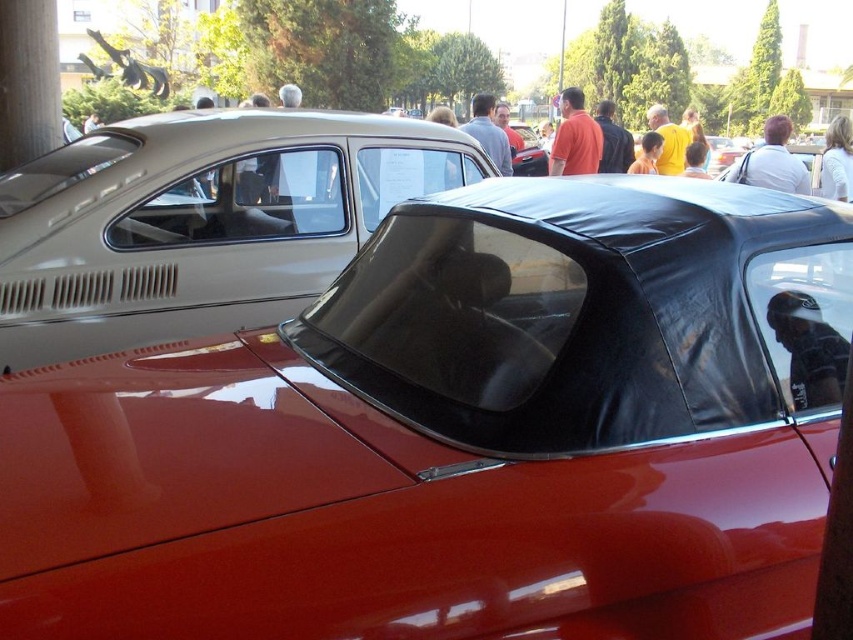
Question: Does dark gray leather jacket at upper right have a greater width compared to yellow t-shirt at upper right?

Choices:
 (A) yes
 (B) no

Answer: (B)

Question: Which point is closer to the camera taking this photo?

Choices:
 (A) (662, 115)
 (B) (819, 324)
 (C) (772, 140)

Answer: (B)

Question: Which object is positioned farthest from the dark gray leather jacket at upper right?

Choices:
 (A) matte orange shirt at upper center
 (B) matte black car at center
 (C) yellow shirt at center

Answer: (C)

Question: Does matte gray shirt at center appear over yellow t-shirt at upper right?

Choices:
 (A) yes
 (B) no

Answer: (B)

Question: From the image, what is the correct spatial relationship of yellow t-shirt at upper right in relation to yellow shirt at center?

Choices:
 (A) right
 (B) left

Answer: (A)

Question: Which object is closer to the camera taking this photo?

Choices:
 (A) dark gray leather jacket at upper right
 (B) matte gray shirt at center
 (C) light blue shirt at upper center
 (D) matte orange shirt at upper center

Answer: (A)